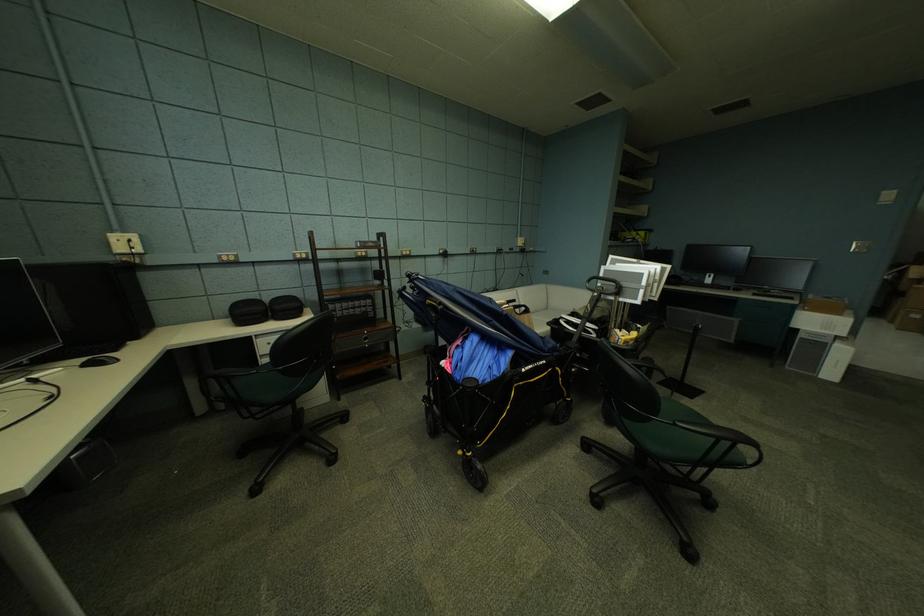
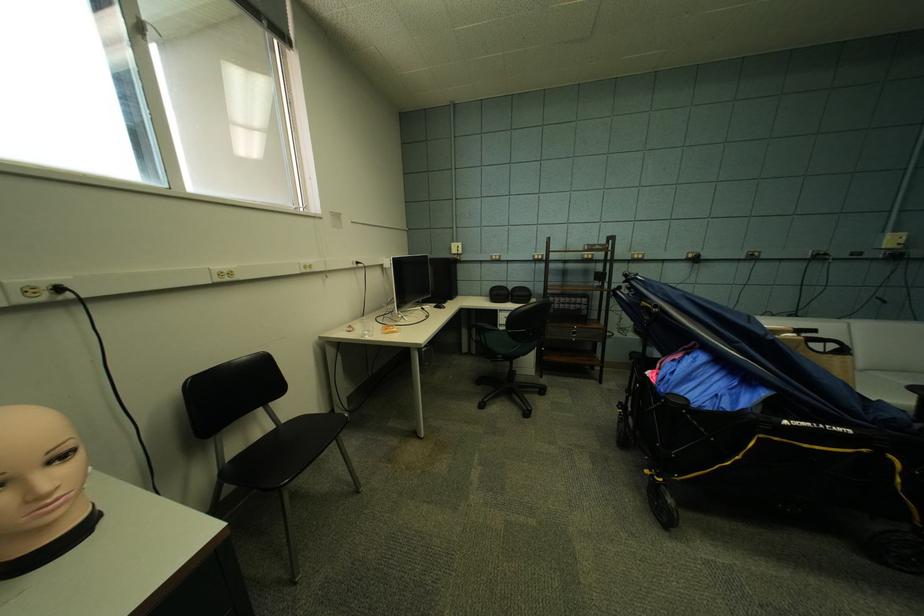
The point at (200, 385) is marked in the first image. Where is the corresponding point in the second image?

(473, 333)